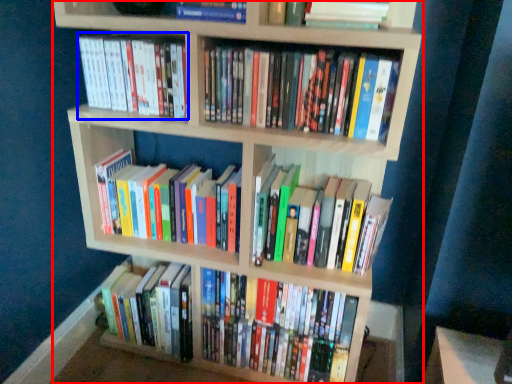
Question: Among these objects, which one is farthest to the camera, bookcase (highlighted by a red box) or book (highlighted by a blue box)?

Choices:
 (A) bookcase
 (B) book

Answer: (B)